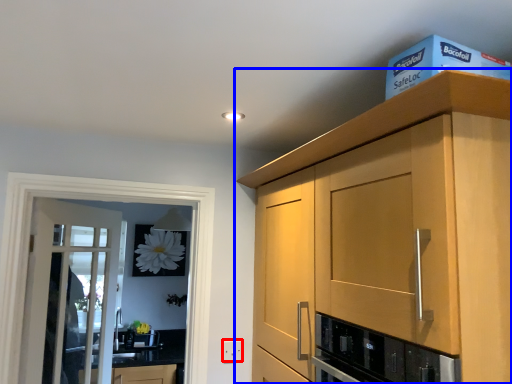
Question: Which of the following is the farthest to the observer, electric outlet (highlighted by a red box) or cabinetry (highlighted by a blue box)?

Choices:
 (A) electric outlet
 (B) cabinetry

Answer: (A)